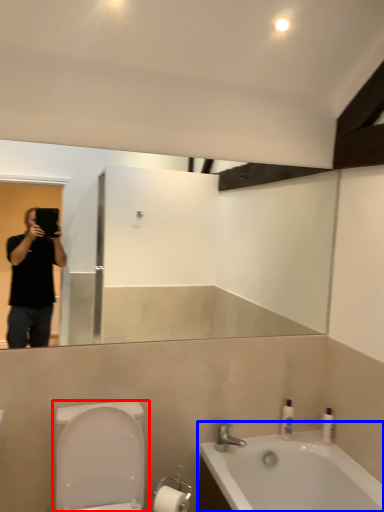
Question: Which of the following is the farthest to the observer, toilet (highlighted by a red box) or bathtub (highlighted by a blue box)?

Choices:
 (A) toilet
 (B) bathtub

Answer: (B)